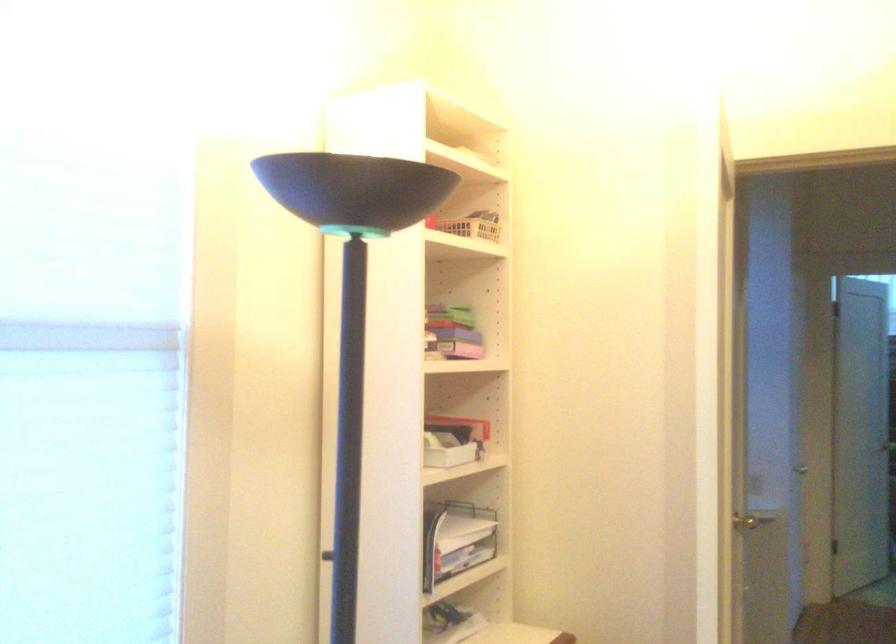
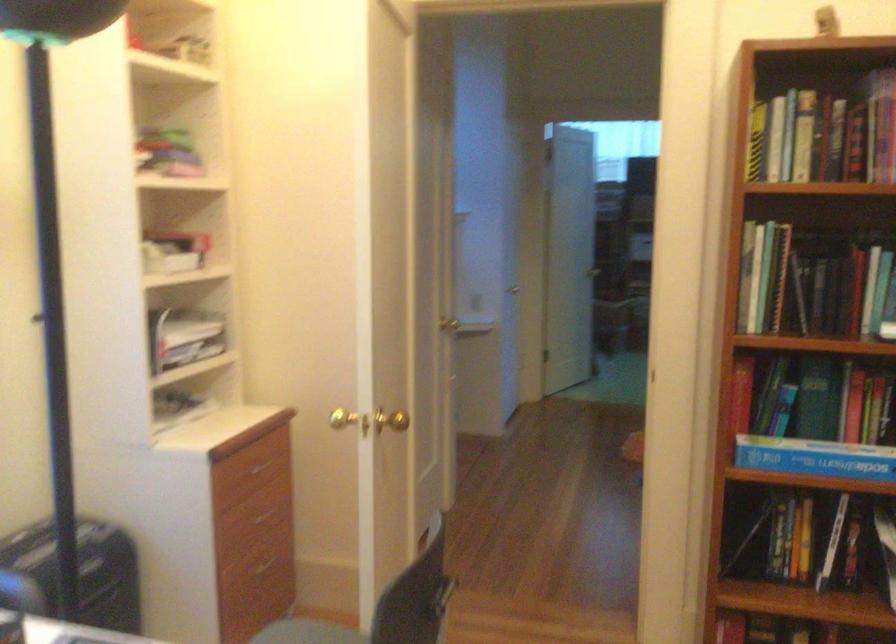
Which direction would the cameraman need to move to produce the second image?

The cameraman moved toward right, backward.